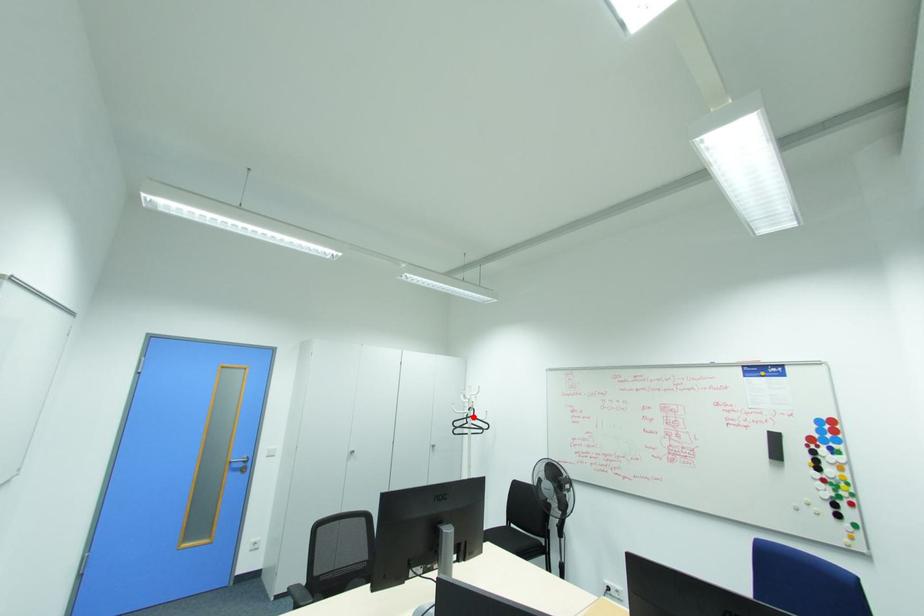
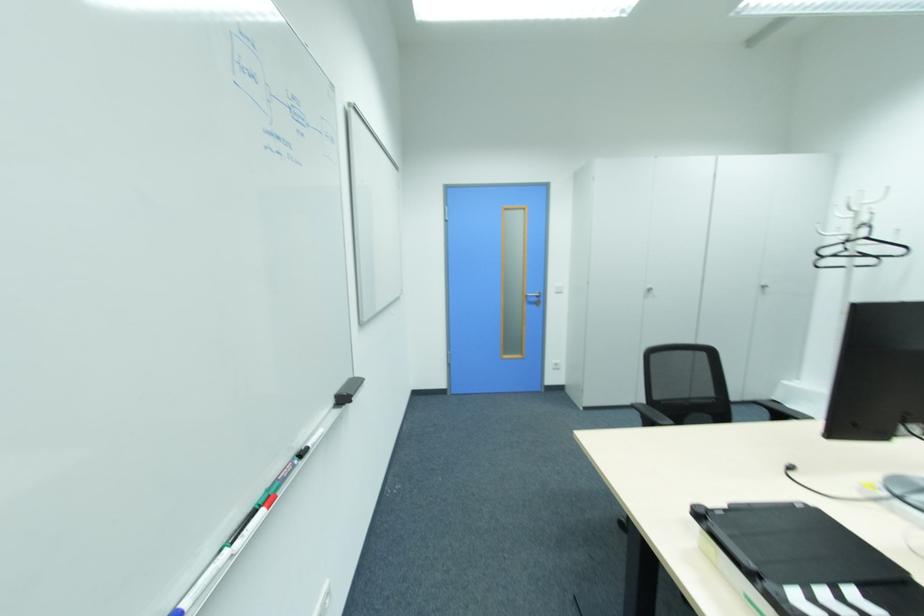
Question: I am providing you with two images of the same scene from different viewpoints. A red point is shown in image1. For the corresponding object point in image2, is it positioned nearer or farther from the camera?

Choices:
 (A) Nearer
 (B) Farther

Answer: (A)